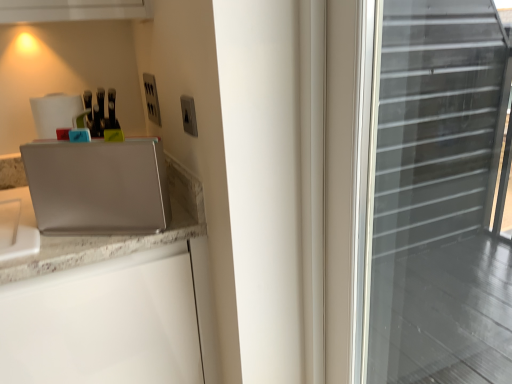
Question: Which direction should I rotate to look at satin silver outlet at upper center, placed as the 1th electric outlet when sorted from left to right?

Choices:
 (A) right
 (B) left

Answer: (B)

Question: Considering the relative sizes of satin silver laptop at left and satin silver switch at upper center, acting as the second electric outlet starting from the left, in the image provided, is satin silver laptop at left wider than satin silver switch at upper center, acting as the second electric outlet starting from the left,?

Choices:
 (A) no
 (B) yes

Answer: (B)

Question: Can you confirm if satin silver laptop at left is positioned to the right of satin silver switch at upper center, the first electric outlet in the front-to-back sequence?

Choices:
 (A) no
 (B) yes

Answer: (A)

Question: Considering the relative sizes of satin silver laptop at left and satin silver switch at upper center, acting as the first electric outlet starting from the right, in the image provided, is satin silver laptop at left bigger than satin silver switch at upper center, acting as the first electric outlet starting from the right,?

Choices:
 (A) no
 (B) yes

Answer: (B)

Question: From the image's perspective, would you say satin silver laptop at left is positioned over satin silver switch at upper center, acting as the first electric outlet starting from the right?

Choices:
 (A) yes
 (B) no

Answer: (B)

Question: Are satin silver laptop at left and satin silver switch at upper center, the first electric outlet in the front-to-back sequence, located far from each other?

Choices:
 (A) no
 (B) yes

Answer: (A)

Question: Is satin silver laptop at left not within satin silver switch at upper center, which is the 2th electric outlet from back to front?

Choices:
 (A) no
 (B) yes

Answer: (B)

Question: Is satin silver switch at upper center, acting as the first electric outlet starting from the right, far away from satin silver outlet at upper center, positioned as the 1th electric outlet in back-to-front order?

Choices:
 (A) yes
 (B) no

Answer: (B)

Question: From a real-world perspective, is satin silver switch at upper center, acting as the second electric outlet starting from the left, beneath satin silver outlet at upper center, which is the 2th electric outlet in front-to-back order?

Choices:
 (A) no
 (B) yes

Answer: (A)

Question: From a real-world perspective, is satin silver switch at upper center, acting as the second electric outlet starting from the left, over satin silver outlet at upper center, which is the 2th electric outlet in front-to-back order?

Choices:
 (A) yes
 (B) no

Answer: (A)

Question: Can you confirm if satin silver switch at upper center, acting as the second electric outlet starting from the left, is positioned to the right of satin silver outlet at upper center, which is the 2th electric outlet in front-to-back order?

Choices:
 (A) no
 (B) yes

Answer: (B)

Question: Is satin silver outlet at upper center, which is the 2th electric outlet from right to left, completely or partially inside satin silver switch at upper center, which is the 2th electric outlet from back to front?

Choices:
 (A) yes
 (B) no

Answer: (B)

Question: Does satin silver switch at upper center, the first electric outlet in the front-to-back sequence, come in front of satin silver outlet at upper center, which is the 2th electric outlet from right to left?

Choices:
 (A) no
 (B) yes

Answer: (B)

Question: From a real-world perspective, is satin silver switch at upper center, acting as the first electric outlet starting from the right, physically below satin silver laptop at left?

Choices:
 (A) no
 (B) yes

Answer: (A)